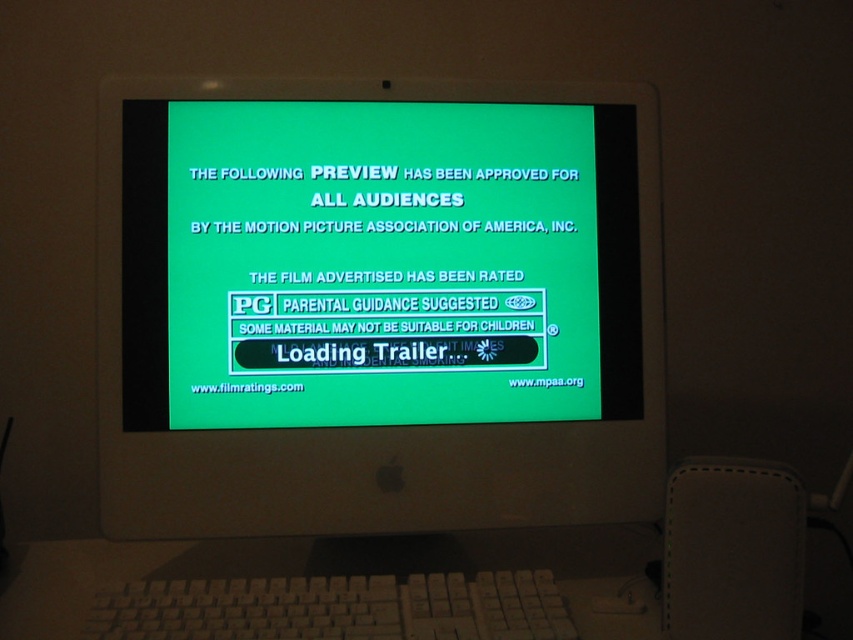
You are trying to reach the white plastic keyboard at lower center to type a command, but the white plastic monitor at center is blocking your access. Can you move the monitor to the side to get to the keyboard?

The white plastic keyboard at lower center is behind the white plastic monitor at center, so you cannot reach it without moving the monitor. However, since the monitor is part of an Apple iMac, it is likely integrated with the computer tower and cannot be easily moved. You may need to adjust your position or use a wireless keyboard instead.